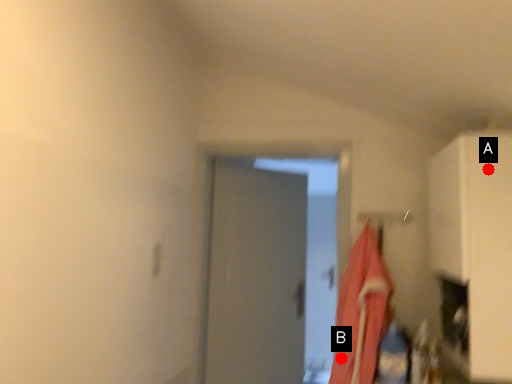
Question: Two points are circled on the image, labeled by A and B beside each circle. Which point is closer to the camera taking this photo?

Choices:
 (A) A is closer
 (B) B is closer

Answer: (A)